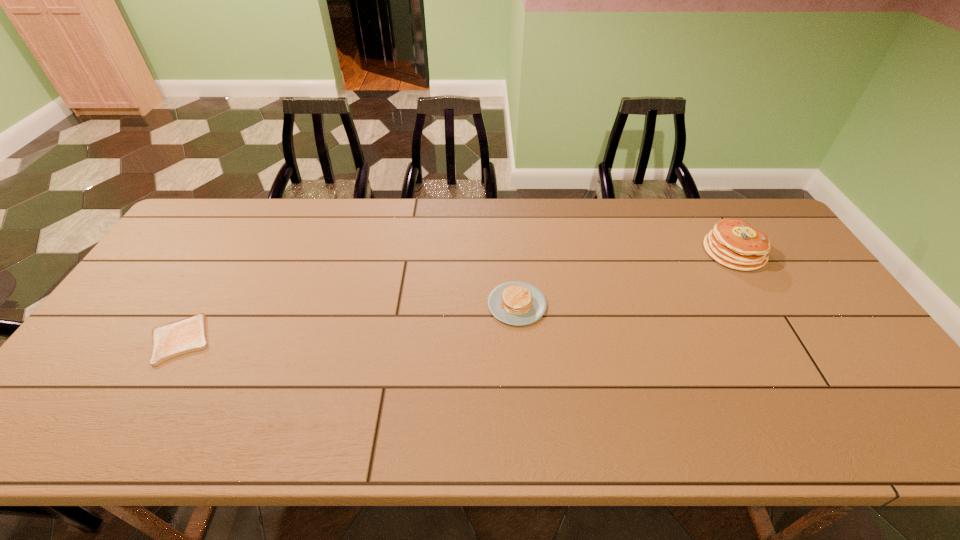
Where is `the second closest object relative to the shortest object`? This screenshot has width=960, height=540. the second closest object relative to the shortest object is located at coordinates (733, 243).

Find the location of a particular element. vacant space that satisfies the following two spatial constraints: 1. on the back side of the shortest object; 2. on the right side of the nearer pancake is located at coordinates (202, 305).

This screenshot has height=540, width=960. In order to click on free space that satisfies the following two spatial constraints: 1. on the back side of the tallest object; 2. on the right side of the leftmost object in this screenshot , I will do `click(232, 252)`.

Locate an element on the screen. free location that satisfies the following two spatial constraints: 1. on the back side of the nearer pancake; 2. on the right side of the rightmost object is located at coordinates (513, 252).